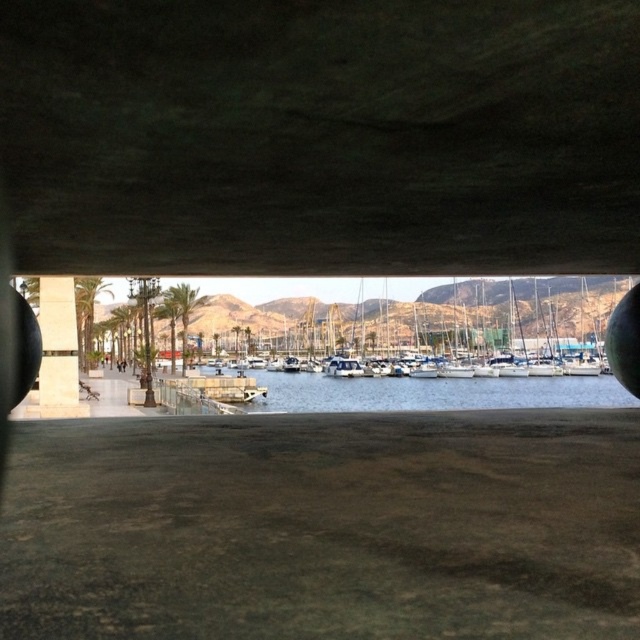
Question: Which of the following is the farthest from the observer?

Choices:
 (A) (330, 317)
 (B) (429, 387)
 (C) (60, 317)
 (D) (177, 44)

Answer: (A)

Question: Is white glossy boats at center positioned behind clear water at center?

Choices:
 (A) yes
 (B) no

Answer: (A)

Question: Which point is closer to the camera?

Choices:
 (A) (556, 36)
 (B) (339, 406)
 (C) (465, 348)

Answer: (A)

Question: Based on their relative distances, which object is farther from the beige concrete pillar at left?

Choices:
 (A) clear water at center
 (B) white glossy boats at center

Answer: (B)

Question: Is dark concrete overpass at upper center positioned in front of white glossy boats at center?

Choices:
 (A) yes
 (B) no

Answer: (A)

Question: Is white glossy boats at center positioned before clear water at center?

Choices:
 (A) no
 (B) yes

Answer: (A)